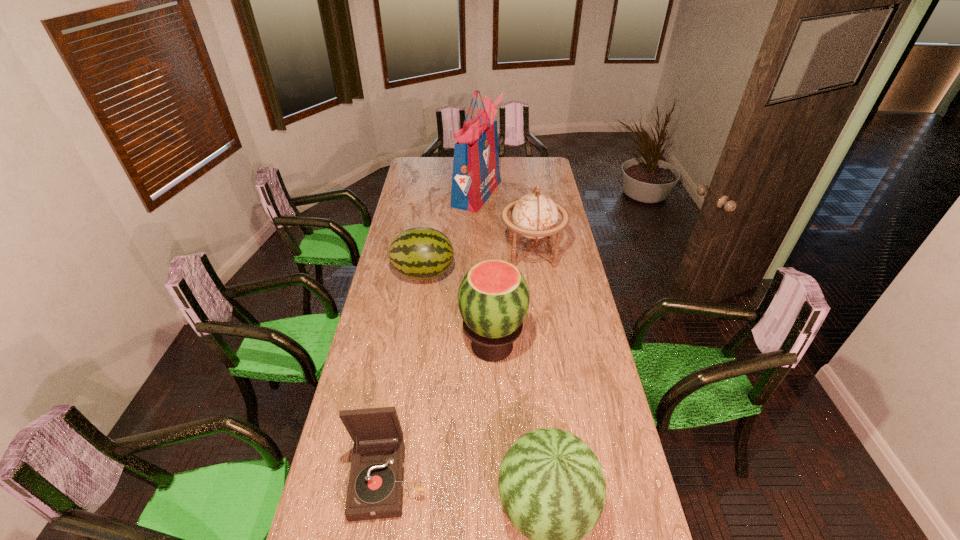
Locate an element on the screen. Image resolution: width=960 pixels, height=540 pixels. vacant position in the image that satisfies the following two spatial constraints: 1. at the front of the globe showing Africa; 2. on the front side of the phonograph record is located at coordinates 564,480.

Where is `free point that satisfies the following two spatial constraints: 1. on the front-facing side of the tallest object; 2. on the right side of the second farthest watermelon`? This screenshot has width=960, height=540. free point that satisfies the following two spatial constraints: 1. on the front-facing side of the tallest object; 2. on the right side of the second farthest watermelon is located at coordinates (475, 345).